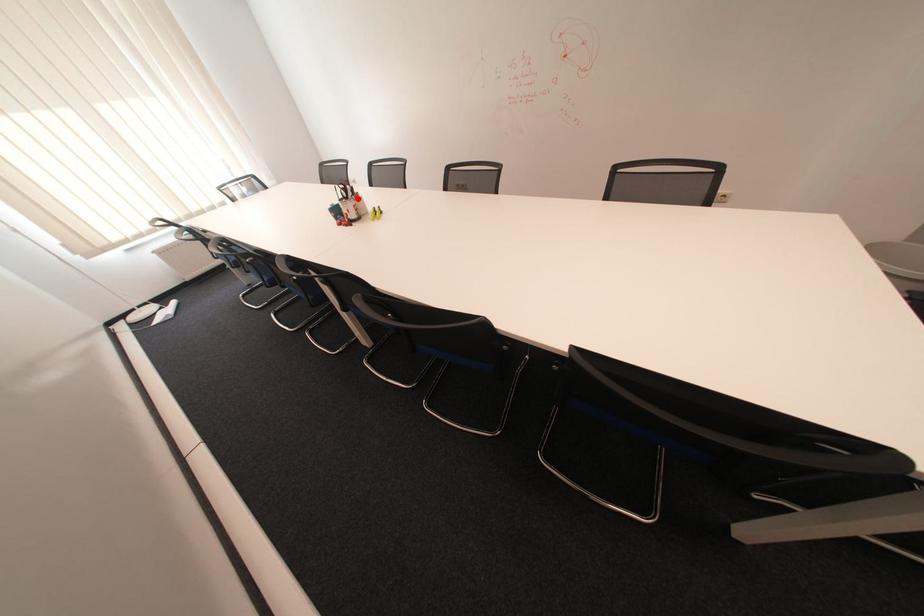
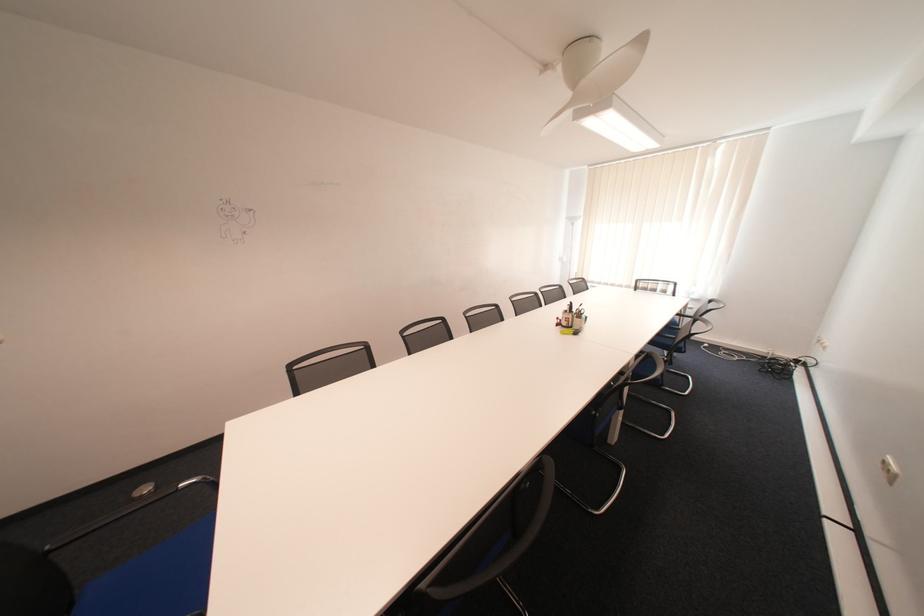
Question: I am providing you with two images of the same scene from different viewpoints. Given a red point in image1, look at the same physical point in image2. Is it:

Choices:
 (A) Closer to the viewpoint
 (B) Farther from the viewpoint

Answer: (B)